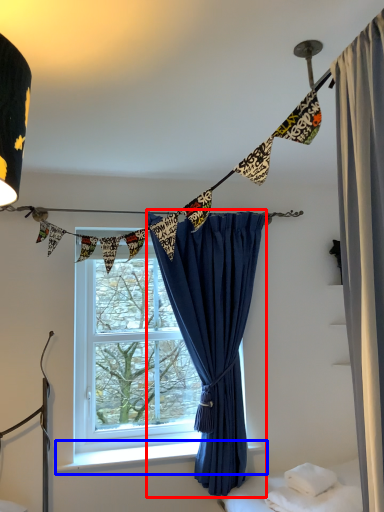
Question: Which of the following is the farthest to the observer, curtain (highlighted by a red box) or window sill (highlighted by a blue box)?

Choices:
 (A) curtain
 (B) window sill

Answer: (B)